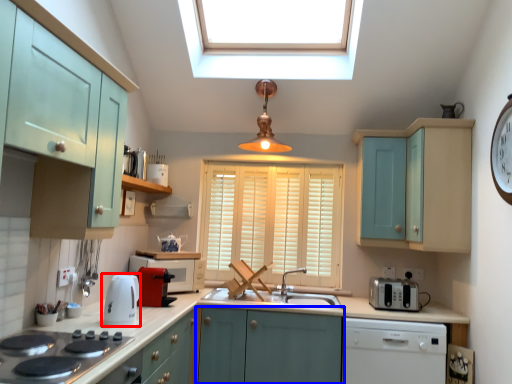
Question: Which object is closer to the camera taking this photo, kitchen appliance (highlighted by a red box) or cabinetry (highlighted by a blue box)?

Choices:
 (A) kitchen appliance
 (B) cabinetry

Answer: (A)